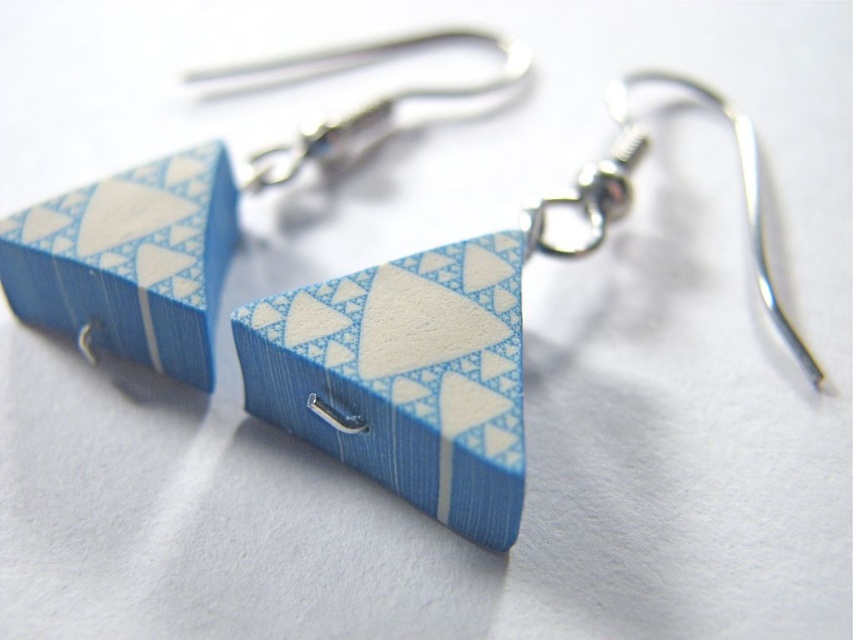
You are an appraiser examining the placement of the blue wood triangle at center in the image. What are the coordinates of its position?

The coordinates of the blue wood triangle at center are at point (131, 260).

You are examining the earrings from the front. Which of the two points, point (x=329, y=419) or point (x=165, y=163), is closer to your eyes?

Point (x=329, y=419) is closer to the camera than point (x=165, y=163), so it is closer to your eyes.

You are a jewelry designer examining the earrings. You need to determine if the matte blue wood triangle at center will cover the silver metallic hook at upper center when viewed from the front. Based on their sizes, what is your conclusion?

The matte blue wood triangle at center is larger in size than the silver metallic hook at upper center, so it will cover the hook when viewed from the front.